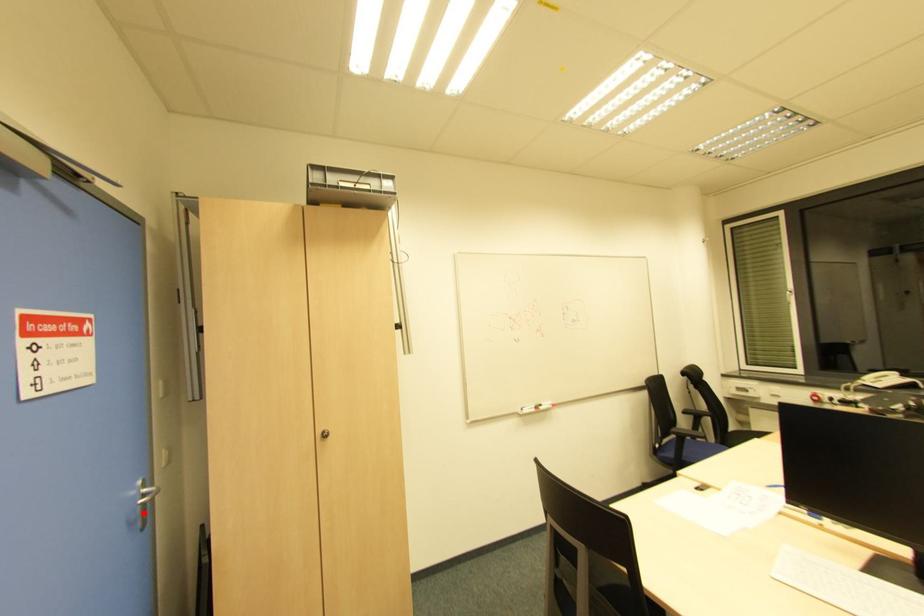
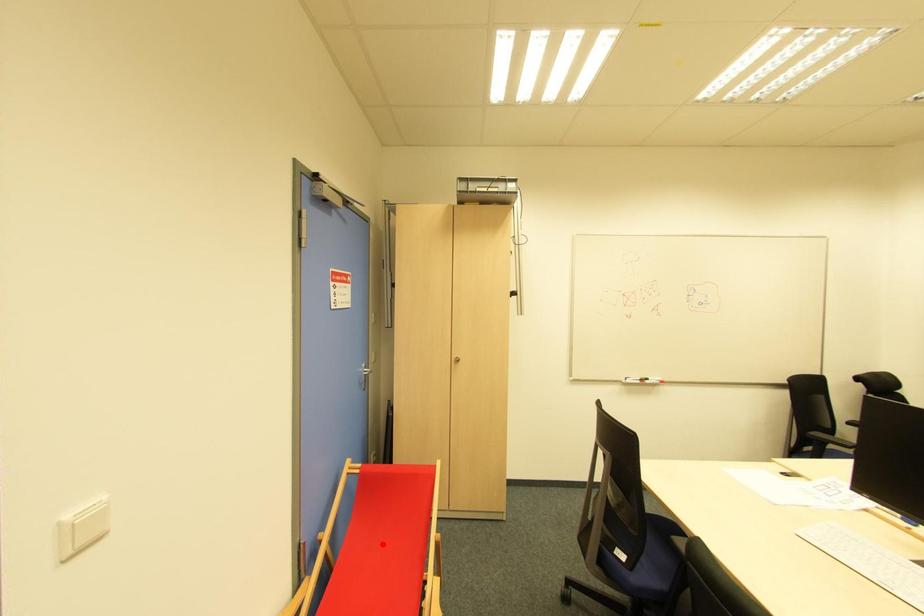
I am providing you with two images of the same scene from different viewpoints. A red point is marked on the first image and another point is marked on the second image. Does the point marked in image1 correspond to the same location as the one in image2?

No